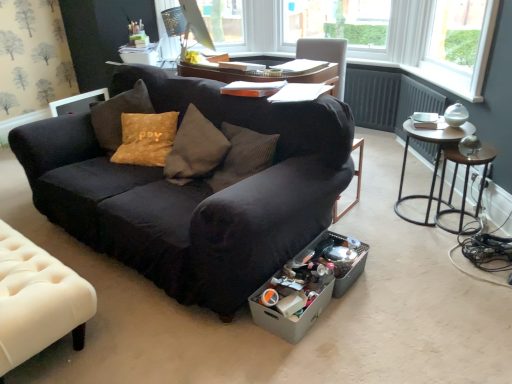
Where is `vacant space behind metallic round table at right`? The image size is (512, 384). vacant space behind metallic round table at right is located at coordinates (396, 187).